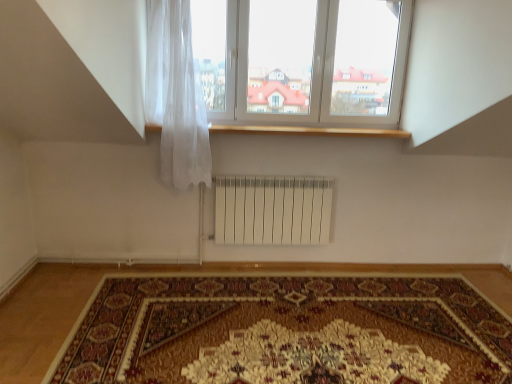
Measure the distance between point (391, 75) and camera.

Point (391, 75) is 3.60 meters from camera.

Measure the distance between translucent white curtain at upper left and camera.

A distance of 2.95 meters exists between translucent white curtain at upper left and camera.

The width and height of the screenshot is (512, 384). I want to click on wooden at upper center, so click(x=310, y=131).

Which of these two, wooden at upper center or carpeted rug at center, is smaller?

wooden at upper center is smaller.

Is wooden at upper center placed right next to carpeted rug at center?

wooden at upper center and carpeted rug at center are not in contact.

Is wooden at upper center positioned behind carpeted rug at center?

Yes, it is behind carpeted rug at center.

From a real-world perspective, is wooden at upper center above or below carpeted rug at center?

wooden at upper center is situated higher than carpeted rug at center in the real world.

In the scene shown: Considering the sizes of carpeted rug at center and wooden at upper center in the image, is carpeted rug at center bigger or smaller than wooden at upper center?

carpeted rug at center is bigger than wooden at upper center.

Is carpeted rug at center not near wooden at upper center?

carpeted rug at center is far away from wooden at upper center.

Would you say carpeted rug at center contains wooden at upper center?

No, wooden at upper center is located outside of carpeted rug at center.

Find the location of a particular element. The height and width of the screenshot is (384, 512). window sill above the carpeted rug at center (from the image's perspective) is located at coordinates (310, 131).

Is carpeted rug at center wider or thinner than white plastic window at upper center?

In the image, carpeted rug at center appears to be wider than white plastic window at upper center.

Is carpeted rug at center looking in the opposite direction of white plastic window at upper center?

carpeted rug at center does not have its back to white plastic window at upper center.

I want to click on window behind the carpeted rug at center, so click(x=330, y=77).

Which object is positioned more to the left, carpeted rug at center or white plastic window at upper center?

carpeted rug at center is more to the left.

From the image's perspective, which one is positioned higher, white plastic window at upper center or translucent white curtain at upper left?

white plastic window at upper center appears higher in the image.

From a real-world perspective, is white plastic window at upper center above or below translucent white curtain at upper left?

Clearly, from a real-world perspective, white plastic window at upper center is above translucent white curtain at upper left.

Does point (314, 38) come farther from viewer compared to point (176, 155)?

Yes, point (314, 38) is behind point (176, 155).

Considering the sizes of translucent white curtain at upper left and wooden at upper center in the image, is translucent white curtain at upper left taller or shorter than wooden at upper center?

translucent white curtain at upper left is taller than wooden at upper center.

From the image's perspective, which one is positioned higher, translucent white curtain at upper left or wooden at upper center?

translucent white curtain at upper left.

Is translucent white curtain at upper left at the right side of wooden at upper center?

In fact, translucent white curtain at upper left is to the left of wooden at upper center.

Is point (193, 78) closer to camera compared to point (152, 124)?

Yes, it is in front of point (152, 124).

Considering their positions, is white plastic window at upper center located in front of or behind wooden at upper center?

white plastic window at upper center is positioned closer to the viewer than wooden at upper center.

From the image's perspective, which object appears higher, white plastic window at upper center or wooden at upper center?

white plastic window at upper center, from the image's perspective.

Between white plastic window at upper center and wooden at upper center, which one has larger width?

wooden at upper center is wider.

Which is in front, point (317, 71) or point (277, 131)?

The point (317, 71) is more forward.

Is carpeted rug at center spatially inside translucent white curtain at upper left, or outside of it?

carpeted rug at center is not enclosed by translucent white curtain at upper left.

Does point (202, 308) appear closer or farther from the camera than point (193, 67)?

Point (202, 308) is positioned closer to the camera compared to point (193, 67).

Based on the photo, does carpeted rug at center have a lesser width compared to translucent white curtain at upper left?

No.

Is carpeted rug at center aimed at translucent white curtain at upper left?

No.

Identify the location of mat below the wooden at upper center (from a real-world perspective). The width and height of the screenshot is (512, 384). (286, 332).

You are a GUI agent. You are given a task and a screenshot of the screen. Output one action in this format:
    pyautogui.click(x=<x>, y=<y>)
    Task: Click on the window sill on the left of carpeted rug at center
    Image resolution: width=512 pixels, height=384 pixels.
    Given the screenshot: What is the action you would take?
    pyautogui.click(x=310, y=131)

Looking at the image, which one is located further to white plastic window at upper center, wooden at upper center or translucent white curtain at upper left?

translucent white curtain at upper left is further to white plastic window at upper center.

Considering their positions, is wooden at upper center positioned further to carpeted rug at center than translucent white curtain at upper left?

→ Based on the image, wooden at upper center appears to be further to carpeted rug at center.

From the picture: When comparing their distances from carpeted rug at center, does wooden at upper center or white plastic window at upper center seem closer?

wooden at upper center.

Based on their spatial positions, is translucent white curtain at upper left or carpeted rug at center further from white plastic window at upper center?

carpeted rug at center lies further to white plastic window at upper center than the other object.

From the picture: When comparing their distances from white plastic window at upper center, does carpeted rug at center or translucent white curtain at upper left seem closer?

translucent white curtain at upper left is closer to white plastic window at upper center.

Considering their positions, is carpeted rug at center positioned closer to translucent white curtain at upper left than wooden at upper center?

Among the two, wooden at upper center is located nearer to translucent white curtain at upper left.

Looking at this image, when comparing their distances from wooden at upper center, does translucent white curtain at upper left or white plastic window at upper center seem further?

translucent white curtain at upper left is positioned further to the anchor wooden at upper center.

When comparing their distances from wooden at upper center, does carpeted rug at center or white plastic window at upper center seem closer?

white plastic window at upper center.

I want to click on window sill between translucent white curtain at upper left and carpeted rug at center from top to bottom, so click(310, 131).

Where is `window sill situated between translucent white curtain at upper left and white plastic window at upper center from left to right`? This screenshot has width=512, height=384. window sill situated between translucent white curtain at upper left and white plastic window at upper center from left to right is located at coordinates click(x=310, y=131).

The image size is (512, 384). Find the location of `curtain that lies between white plastic window at upper center and carpeted rug at center from top to bottom`. curtain that lies between white plastic window at upper center and carpeted rug at center from top to bottom is located at coordinates (176, 95).

Find the location of `window sill between white plastic window at upper center and carpeted rug at center in the vertical direction`. window sill between white plastic window at upper center and carpeted rug at center in the vertical direction is located at coordinates (310, 131).